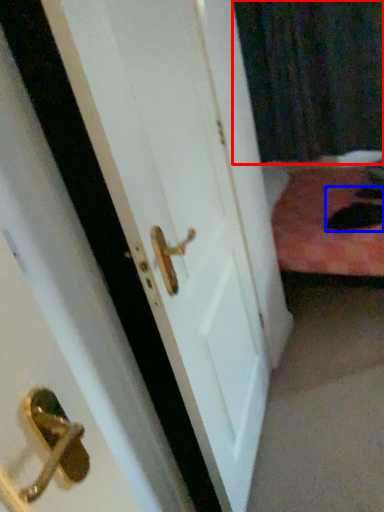
Question: Which point is further to the camera, curtain (highlighted by a red box) or cat (highlighted by a blue box)?

Choices:
 (A) curtain
 (B) cat

Answer: (A)